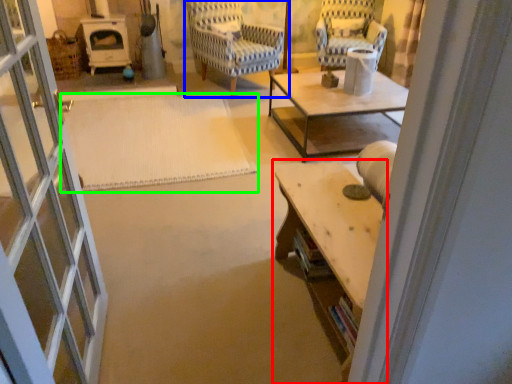
Question: Considering the real-world distances, which object is farthest from table (highlighted by a red box)? chair (highlighted by a blue box) or mat (highlighted by a green box)?

Choices:
 (A) chair
 (B) mat

Answer: (A)